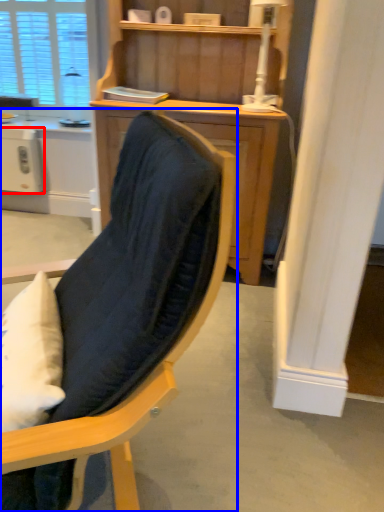
Question: Which object appears closest to the camera in this image, appliance (highlighted by a red box) or chair (highlighted by a blue box)?

Choices:
 (A) appliance
 (B) chair

Answer: (B)